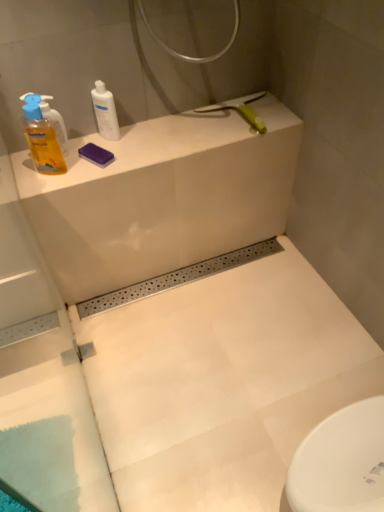
Question: Considering the positions of yellow translucent liquid at left, the 2th cleaning product from the right, and white matte counter top at upper left in the image, is yellow translucent liquid at left, the 2th cleaning product from the right, wider or thinner than white matte counter top at upper left?

Choices:
 (A) wide
 (B) thin

Answer: (B)

Question: Is point (41, 138) closer or farther from the camera than point (79, 161)?

Choices:
 (A) closer
 (B) farther

Answer: (A)

Question: Which is farther from the white matte counter top at upper left?

Choices:
 (A) yellow translucent liquid at left, which is the 1th cleaning product in left-to-right order
 (B) white glossy bottle at upper left, arranged as the 2th cleaning product when viewed from the left

Answer: (A)

Question: Which is nearer to the white matte counter top at upper left?

Choices:
 (A) white glossy bottle at upper left, arranged as the 2th cleaning product when viewed from the left
 (B) yellow translucent liquid at left, the 2th cleaning product from the right

Answer: (A)